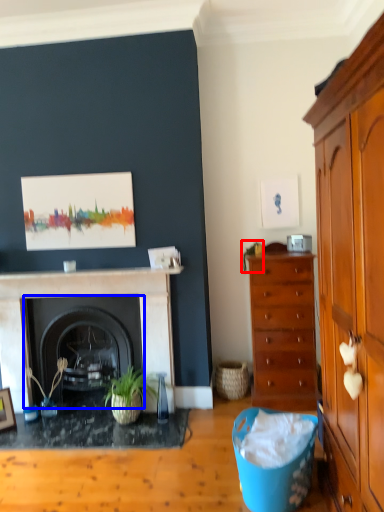
Question: Which object is further to the camera taking this photo, plant (highlighted by a red box) or fireplace (highlighted by a blue box)?

Choices:
 (A) plant
 (B) fireplace

Answer: (A)